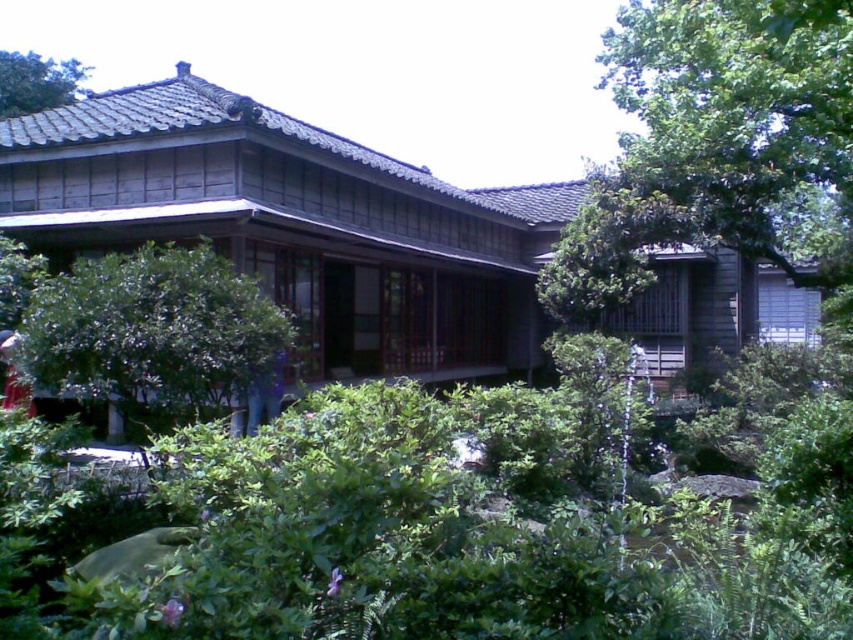
Question: Which of the following is the farthest from the observer?

Choices:
 (A) click(x=15, y=67)
 (B) click(x=103, y=272)

Answer: (A)

Question: Which object appears farthest from the camera in this image?

Choices:
 (A) green leafy bush at center
 (B) green leafy tree at upper left

Answer: (B)

Question: Is green leafy bush at center closer to the viewer compared to green leafy tree at upper left?

Choices:
 (A) no
 (B) yes

Answer: (B)

Question: Does green leafy bush at center appear on the left side of green leafy tree at upper left?

Choices:
 (A) no
 (B) yes

Answer: (A)

Question: Which object is closer to the camera taking this photo?

Choices:
 (A) green leafy bush at center
 (B) green leafy tree at upper left

Answer: (A)

Question: Is green leafy bush at center bigger than green leafy tree at upper left?

Choices:
 (A) no
 (B) yes

Answer: (A)